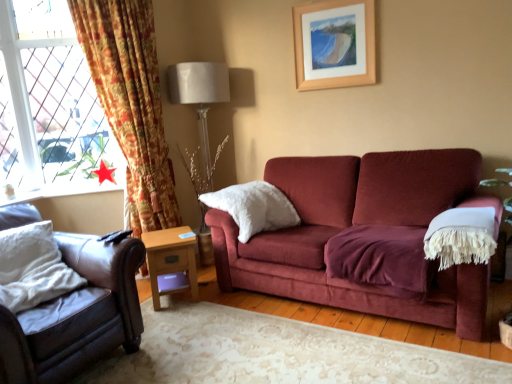
Question: Would you say white soft pillow at left, the 2th pillow from the right, is inside or outside light brown wooden side table at lower center?

Choices:
 (A) inside
 (B) outside

Answer: (B)

Question: Would you say white soft pillow at left, placed as the first pillow when sorted from front to back, is to the left or to the right of light brown wooden side table at lower center in the picture?

Choices:
 (A) right
 (B) left

Answer: (B)

Question: Estimate the real-world distances between objects in this image. Which object is farther from the white fluffy pillow at center, arranged as the first pillow when viewed from the back?

Choices:
 (A) floral fabric curtain at left
 (B) leather couch at left
 (C) light brown wooden side table at lower center
 (D) white soft pillow at left, placed as the first pillow when sorted from front to back
 (E) red fabric star at lower left

Answer: (D)

Question: Which of these objects is positioned closest to the floral fabric curtain at left?

Choices:
 (A) white fabric at upper center
 (B) white fluffy pillow at center, the 1th pillow in the right-to-left sequence
 (C) white soft pillow at left, which appears as the first pillow when viewed from the left
 (D) red fabric star at lower left
 (E) wooden picture frame at upper center

Answer: (D)